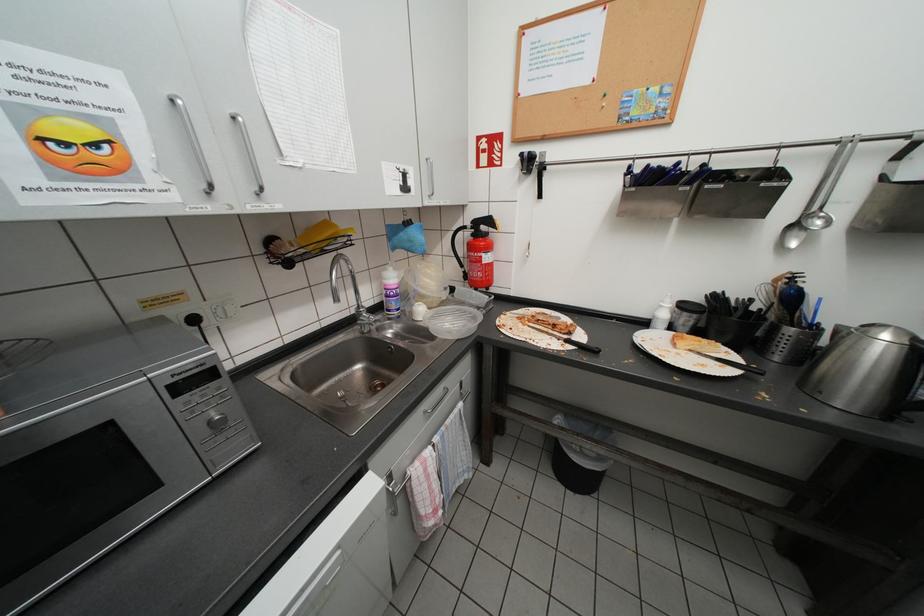
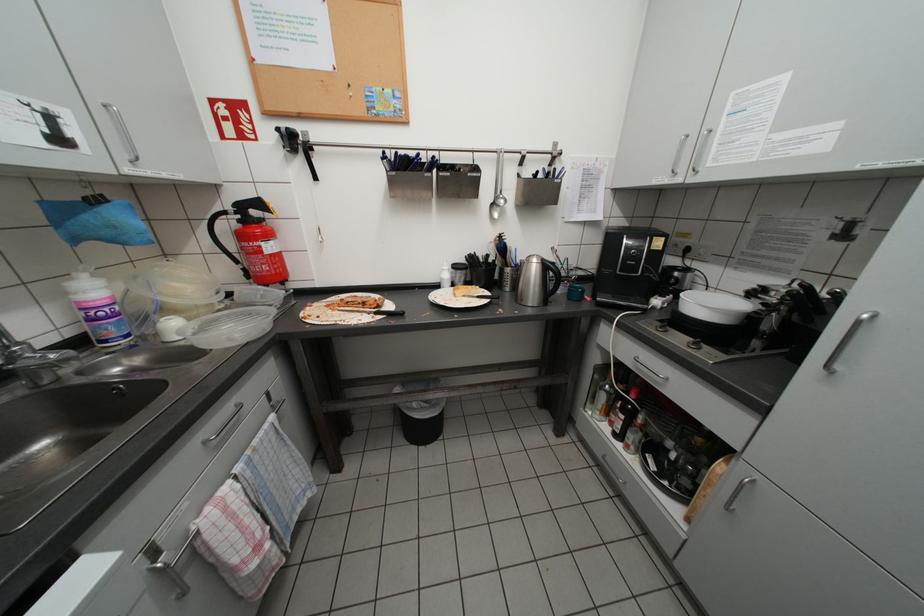
Question: The camera is either moving clockwise (left) or counter-clockwise (right) around the object. The first image is from the beginning of the video and the second image is from the end. Is the camera moving left or right when shooting the video?

Choices:
 (A) Left
 (B) Right

Answer: (A)